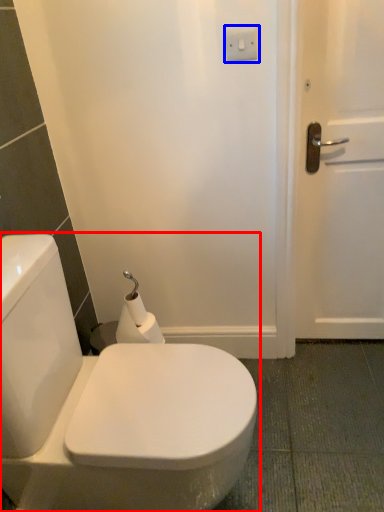
Question: Which object appears farthest to the camera in this image, toilet (highlighted by a red box) or electric outlet (highlighted by a blue box)?

Choices:
 (A) toilet
 (B) electric outlet

Answer: (B)